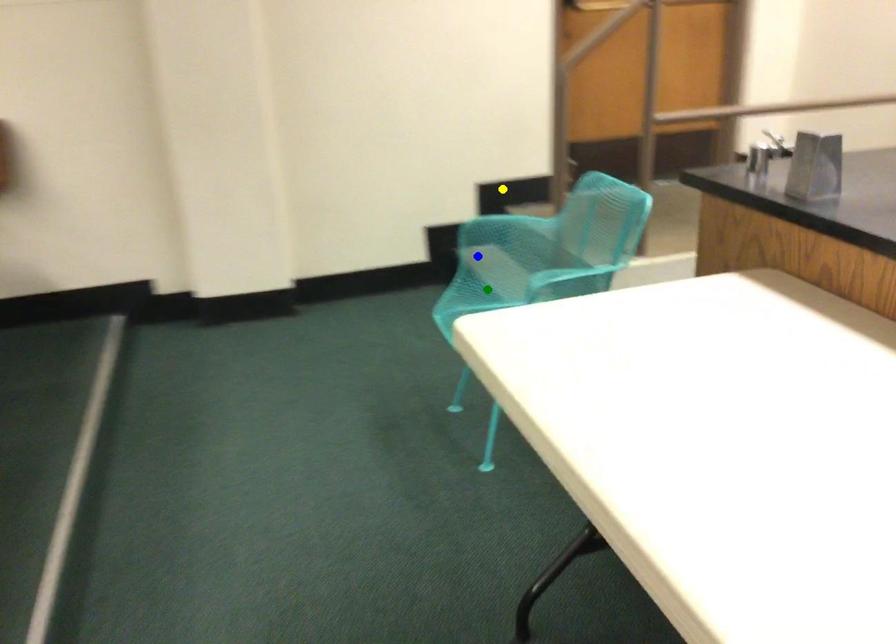
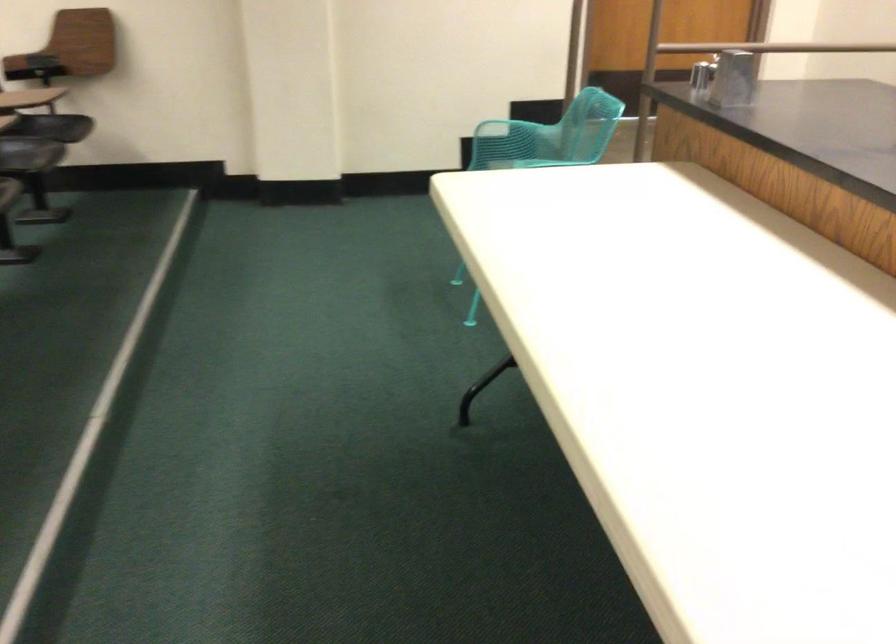
I am providing you with two images of the same scene from different viewpoints. Three points are marked in image1. Which point corresponds to a part or object that is occluded in image2?In image1, three points are marked. Which of them correspond to a part or object that is occluded in image2?Among the three points shown in image1, which one corresponds to a part or object that is no longer visible due to occlusion in image2?

green point